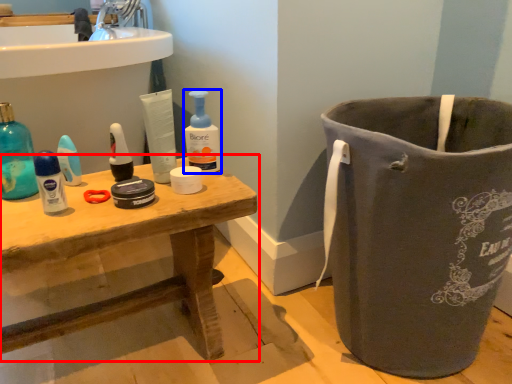
Question: Among these objects, which one is farthest to the camera, table (highlighted by a red box) or cleaning product (highlighted by a blue box)?

Choices:
 (A) table
 (B) cleaning product

Answer: (B)